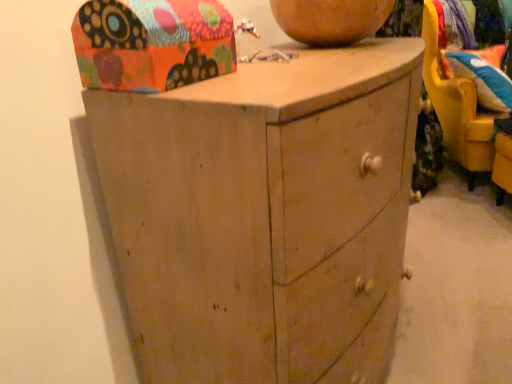
Question: In terms of width, does matte brown vase at upper center look wider or thinner when compared to matte wood chest of drawers at center?

Choices:
 (A) wide
 (B) thin

Answer: (B)

Question: Does point (342, 1) appear closer or farther from the camera than point (131, 92)?

Choices:
 (A) farther
 (B) closer

Answer: (A)

Question: Considering the real-world distances, which object is farthest from the multicolored paper shoe box at upper left?

Choices:
 (A) floral fabric cushion at upper right
 (B) matte brown vase at upper center
 (C) velvet blue pillow at right
 (D) yellow plastic swivel chair at right
 (E) matte wood chest of drawers at center

Answer: (D)

Question: Estimate the real-world distances between objects in this image. Which object is closer to the matte wood chest of drawers at center?

Choices:
 (A) multicolored paper shoe box at upper left
 (B) floral fabric cushion at upper right
 (C) matte brown vase at upper center
 (D) velvet blue pillow at right
 (E) yellow plastic swivel chair at right

Answer: (A)